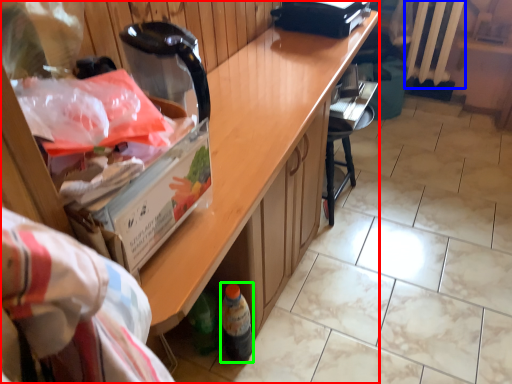
Question: Based on their relative distances, which object is farther from cabinetry (highlighted by a red box)? Choose from radiator (highlighted by a blue box) and bottle (highlighted by a green box).

Choices:
 (A) radiator
 (B) bottle

Answer: (A)